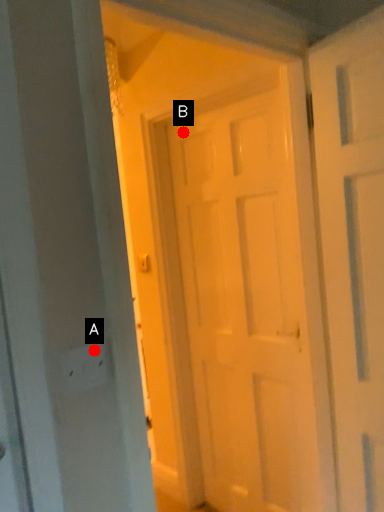
Question: Two points are circled on the image, labeled by A and B beside each circle. Which point is further to the camera?

Choices:
 (A) A is further
 (B) B is further

Answer: (B)